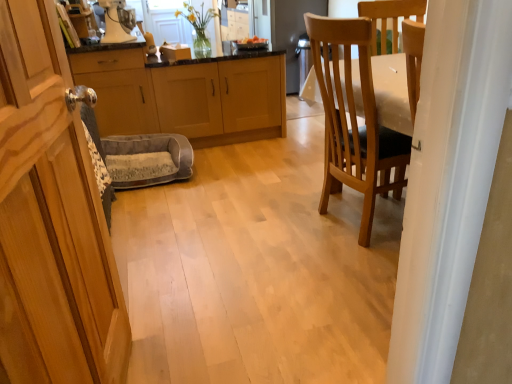
Question: From a real-world perspective, does wooden cabinet at left, which ranks as the third cabinetry in back-to-front order, stand above metallic silver cabinet at left, the second cabinetry viewed from the front?

Choices:
 (A) yes
 (B) no

Answer: (A)

Question: Can you confirm if wooden cabinet at left, which ranks as the third cabinetry in back-to-front order, is positioned to the right of metallic silver cabinet at left, positioned as the second cabinetry in back-to-front order?

Choices:
 (A) no
 (B) yes

Answer: (B)

Question: Can metallic silver cabinet at left, positioned as the second cabinetry in back-to-front order, be found inside wooden cabinet at left, which ranks as the third cabinetry in back-to-front order?

Choices:
 (A) yes
 (B) no

Answer: (B)

Question: Is wooden cabinet at left, positioned as the 1th cabinetry in front-to-back order, bigger than metallic silver cabinet at left, positioned as the second cabinetry in back-to-front order?

Choices:
 (A) yes
 (B) no

Answer: (B)

Question: Is there a large distance between wooden cabinet at left, which ranks as the third cabinetry in back-to-front order, and metallic silver cabinet at left, positioned as the second cabinetry in back-to-front order?

Choices:
 (A) yes
 (B) no

Answer: (A)

Question: Considering the positions of metallic silver cabinet at left, the second cabinetry viewed from the front, and gray plush pet bed at center in the image, is metallic silver cabinet at left, the second cabinetry viewed from the front, taller or shorter than gray plush pet bed at center?

Choices:
 (A) short
 (B) tall

Answer: (B)

Question: Considering the positions of metallic silver cabinet at left, the second cabinetry viewed from the front, and gray plush pet bed at center in the image, is metallic silver cabinet at left, the second cabinetry viewed from the front, bigger or smaller than gray plush pet bed at center?

Choices:
 (A) small
 (B) big

Answer: (B)

Question: In the image, is metallic silver cabinet at left, positioned as the second cabinetry in back-to-front order, on the left side or the right side of gray plush pet bed at center?

Choices:
 (A) left
 (B) right

Answer: (A)

Question: Is point (138, 122) closer or farther from the camera than point (152, 175)?

Choices:
 (A) closer
 (B) farther

Answer: (B)

Question: Looking at the image, does light wood/finish cabinet at center, acting as the 3th cabinetry starting from the front, seem bigger or smaller compared to wooden chair at right?

Choices:
 (A) small
 (B) big

Answer: (B)

Question: Relative to wooden chair at right, is light wood/finish cabinet at center, the 1th cabinetry when ordered from back to front, in front or behind?

Choices:
 (A) behind
 (B) front

Answer: (A)

Question: Considering the positions of point (269, 97) and point (352, 178), is point (269, 97) closer or farther from the camera than point (352, 178)?

Choices:
 (A) closer
 (B) farther

Answer: (B)

Question: Which is correct: light wood/finish cabinet at center, the 1th cabinetry when ordered from back to front, is inside wooden chair at right, or outside of it?

Choices:
 (A) outside
 (B) inside

Answer: (A)

Question: Relative to light wood/finish cabinet at center, the 1th cabinetry when ordered from back to front, is wooden cabinet at left, which ranks as the third cabinetry in back-to-front order, in front or behind?

Choices:
 (A) front
 (B) behind

Answer: (A)

Question: In terms of height, does wooden cabinet at left, which ranks as the third cabinetry in back-to-front order, look taller or shorter compared to light wood/finish cabinet at center, the 1th cabinetry when ordered from back to front?

Choices:
 (A) tall
 (B) short

Answer: (A)